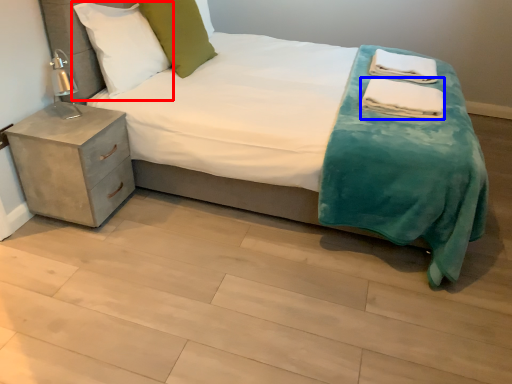
Question: Which object appears farthest to the camera in this image, pillow (highlighted by a red box) or material (highlighted by a blue box)?

Choices:
 (A) pillow
 (B) material

Answer: (B)